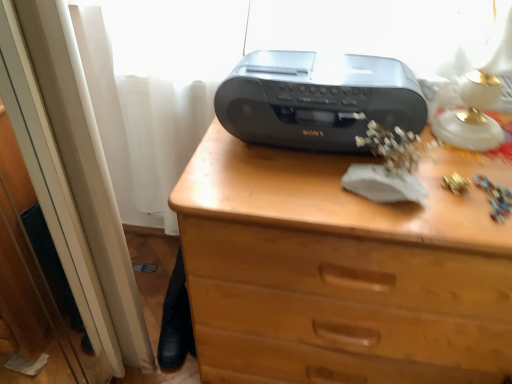
This screenshot has width=512, height=384. Find the location of `free spot in front of satin black radio at center`. free spot in front of satin black radio at center is located at coordinates pyautogui.click(x=326, y=196).